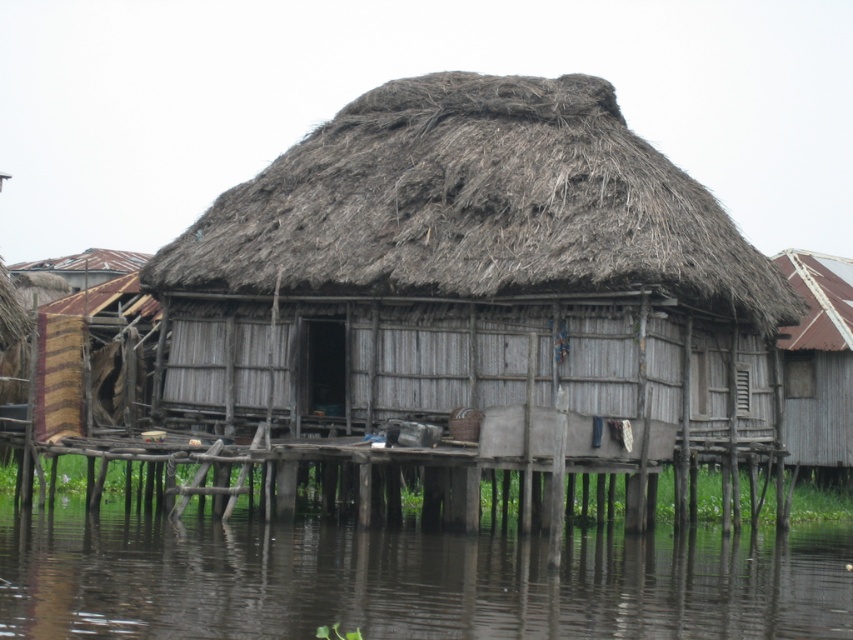
Does dark brown water at lower center have a smaller size compared to wooden hut at right?

Indeed, dark brown water at lower center has a smaller size compared to wooden hut at right.

Between point (294, 634) and point (801, 333), which one is positioned in front?

Point (294, 634) is more forward.

Locate an element on the screen. dark brown water at lower center is located at coordinates (408, 580).

Can you confirm if brown thatch at center is positioned below red tile roof at upper right?

Actually, brown thatch at center is above red tile roof at upper right.

Is brown thatch at center smaller than red tile roof at upper right?

Incorrect, brown thatch at center is not smaller in size than red tile roof at upper right.

This screenshot has height=640, width=853. What do you see at coordinates (476, 208) in the screenshot?
I see `brown thatch at center` at bounding box center [476, 208].

This screenshot has width=853, height=640. I want to click on brown thatch at center, so point(476,208).

Who is shorter, striped fabric at left or red tile roof at upper right?

red tile roof at upper right is shorter.

Can you confirm if striped fabric at left is bigger than red tile roof at upper right?

Yes, striped fabric at left is bigger than red tile roof at upper right.

Between point (93, 320) and point (811, 284), which one is positioned in front?

Point (93, 320) is in front.

Locate an element on the screen. This screenshot has height=640, width=853. striped fabric at left is located at coordinates (115, 346).